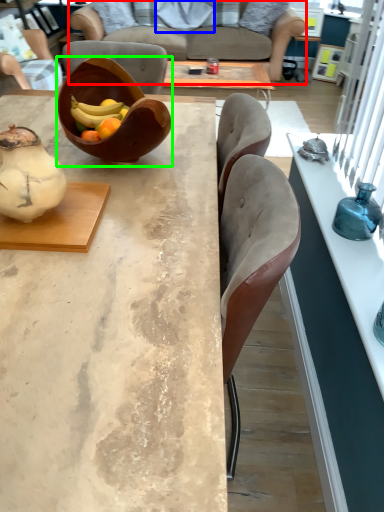
Question: Based on their relative distances, which object is nearer to studio couch (highlighted by a red box)? Choose from pillow (highlighted by a blue box) and bowl (highlighted by a green box).

Choices:
 (A) pillow
 (B) bowl

Answer: (A)